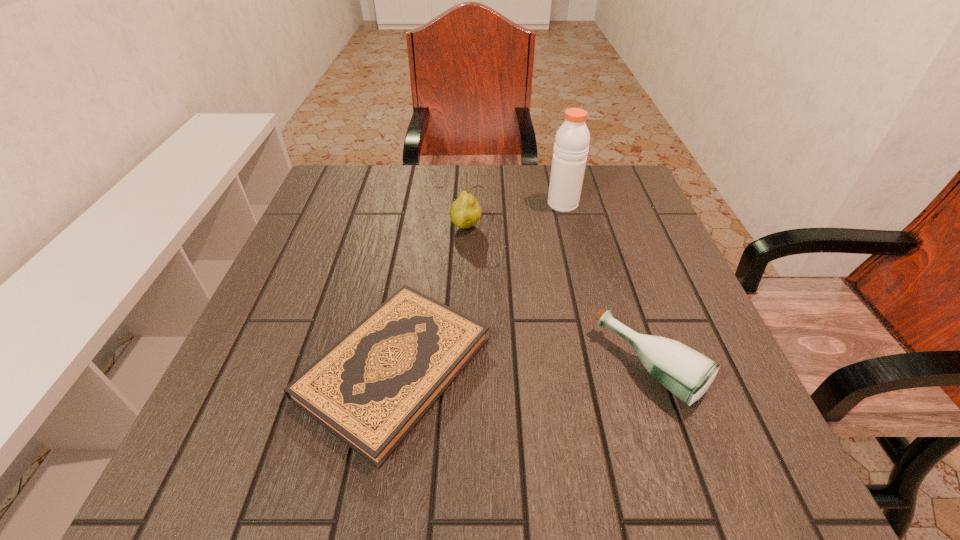
Locate an element on the screen. Image resolution: width=960 pixels, height=540 pixels. shaker is located at coordinates (571, 146).

This screenshot has width=960, height=540. In order to click on the farthest object in this screenshot , I will do `click(571, 146)`.

Locate an element on the screen. This screenshot has height=540, width=960. the second farthest object is located at coordinates (465, 212).

I want to click on pear, so click(x=465, y=212).

Find the location of `bottle`. bottle is located at coordinates (686, 373).

Locate an element on the screen. the shortest object is located at coordinates (370, 389).

Identify the location of vacant space located 0.170m on the right of the shaker. [x=645, y=204].

Locate an element on the screen. vacant space located on the left of the second farthest object is located at coordinates (379, 228).

You are a GUI agent. You are given a task and a screenshot of the screen. Output one action in this format:
    pyautogui.click(x=<x>, y=<y>)
    Task: Click on the vacant space positioned 0.270m on the left of the bottle
    
    Given the screenshot: What is the action you would take?
    pyautogui.click(x=444, y=367)

You are a GUI agent. You are given a task and a screenshot of the screen. Output one action in this format:
    pyautogui.click(x=<x>, y=<y>)
    Task: Click on the vacant space located 0.060m on the back of the hardback book
    The height and width of the screenshot is (540, 960).
    Given the screenshot: What is the action you would take?
    pyautogui.click(x=410, y=275)